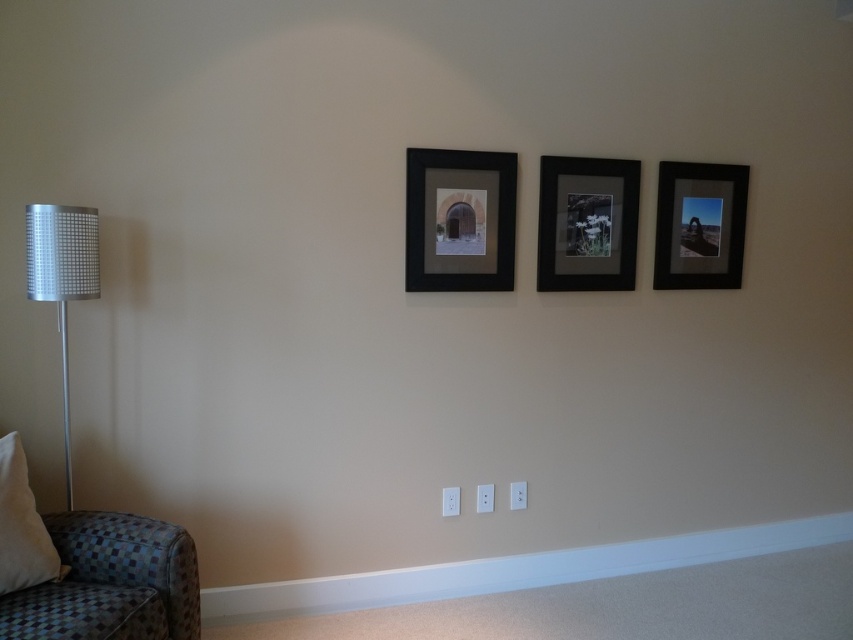
Question: Is silver/metallic floor lamp at left below beige fabric pillow at lower left?

Choices:
 (A) no
 (B) yes

Answer: (A)

Question: Which object is farther from the camera taking this photo?

Choices:
 (A) black matte picture frame at center
 (B) beige fabric pillow at lower left

Answer: (A)

Question: Where is matte black picture frame at upper right located in relation to beige fabric pillow at lower left in the image?

Choices:
 (A) below
 (B) above

Answer: (B)

Question: Estimate the real-world distances between objects in this image. Which object is closer to the matte black picture frame at upper right?

Choices:
 (A) black matte picture frame at center
 (B) blue checkered fabric chair at lower left
 (C) matte black picture frame at center
 (D) silver/metallic floor lamp at left

Answer: (C)

Question: Which is farther from the silver/metallic floor lamp at left?

Choices:
 (A) black matte picture frame at center
 (B) beige fabric pillow at lower left

Answer: (A)

Question: Is black matte picture frame at center further to camera compared to silver/metallic floor lamp at left?

Choices:
 (A) yes
 (B) no

Answer: (A)